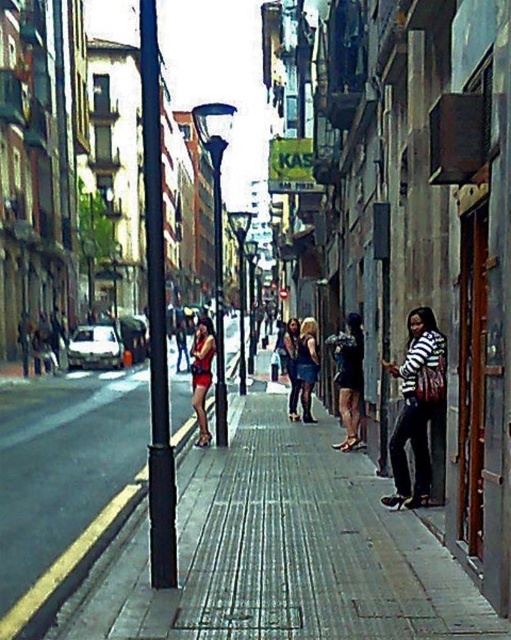
Can you confirm if black metal pole at center-left is bigger than matte black dress at center?

Indeed, black metal pole at center-left has a larger size compared to matte black dress at center.

Does point (157, 449) lie in front of point (289, 416)?

That is True.

Is point (152, 584) positioned after point (290, 358)?

No, (152, 584) is in front of (290, 358).

At what (x,y) coordinates should I click in order to perform the action: click on black metal pole at center-left. Please return your answer as a coordinate pair (x, y). Looking at the image, I should click on (156, 316).

Can you confirm if blue denim skirt at center is shorter than matte black dress at center?

Indeed, blue denim skirt at center has a lesser height compared to matte black dress at center.

Is blue denim skirt at center bigger than matte black dress at center?

No.

Which is behind, point (310, 416) or point (289, 412)?

Positioned behind is point (289, 412).

You are a GUI agent. You are given a task and a screenshot of the screen. Output one action in this format:
    pyautogui.click(x=<x>, y=<y>)
    Task: Click on the blue denim skirt at center
    Image resolution: width=511 pixels, height=640 pixels.
    Given the screenshot: What is the action you would take?
    pyautogui.click(x=307, y=364)

Does black metal pole at center-left have a greater width compared to striped fabric jacket at right?

Indeed, black metal pole at center-left has a greater width compared to striped fabric jacket at right.

Can you confirm if black metal pole at center-left is bigger than striped fabric jacket at right?

Indeed, black metal pole at center-left has a larger size compared to striped fabric jacket at right.

This screenshot has height=640, width=511. What do you see at coordinates (156, 316) in the screenshot?
I see `black metal pole at center-left` at bounding box center [156, 316].

Where is `black metal pole at center-left`? black metal pole at center-left is located at coordinates (156, 316).